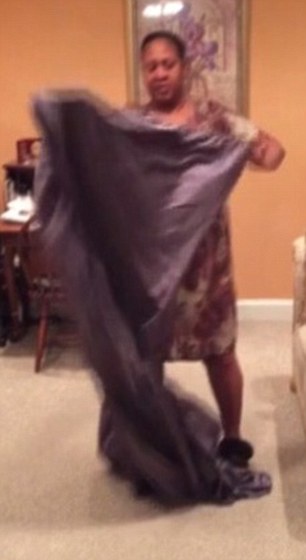
I want to click on desk, so click(x=35, y=241).